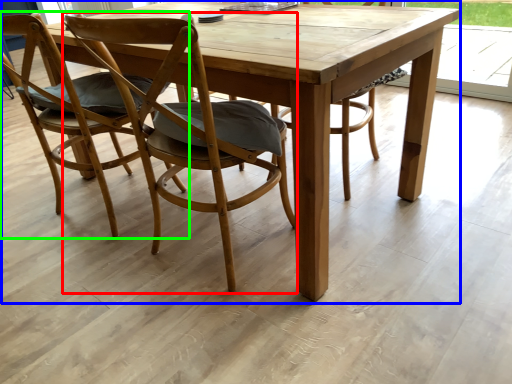
Question: Which object is positioned closest to chair (highlighted by a red box)? Select from picnic table (highlighted by a blue box) and chair (highlighted by a green box).

Choices:
 (A) picnic table
 (B) chair

Answer: (A)